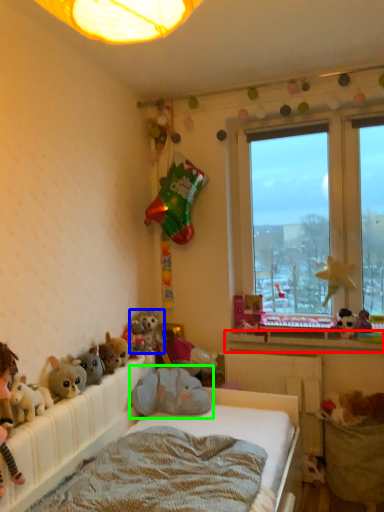
Question: Considering the real-world distances, which object is farthest from window sill (highlighted by a red box)? toy (highlighted by a blue box) or toy (highlighted by a green box)?

Choices:
 (A) toy
 (B) toy

Answer: (A)